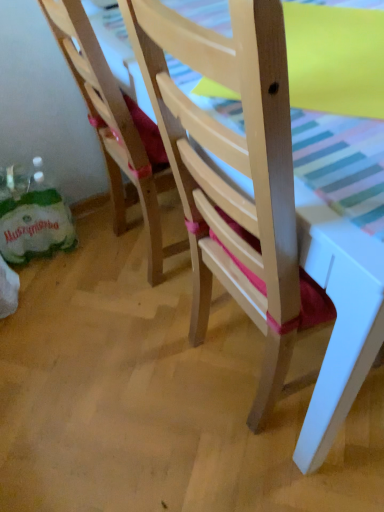
You are a GUI agent. You are given a task and a screenshot of the screen. Output one action in this format:
    pyautogui.click(x=<x>, y=<y>)
    Task: Click on the free space to the left of wooden chair at lower left, the second chair when ordered from right to left
    This screenshot has width=384, height=512.
    Given the screenshot: What is the action you would take?
    click(x=75, y=271)